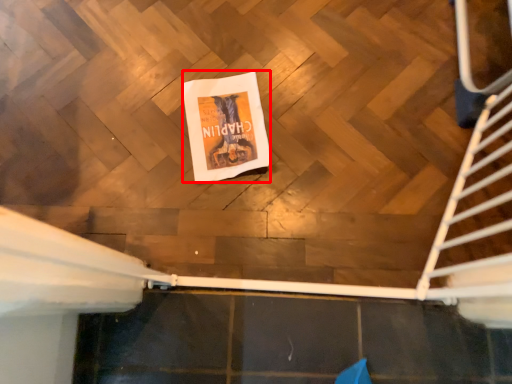
Question: Where is flyer (annotated by the red box) located in relation to stairs in the image?

Choices:
 (A) left
 (B) right

Answer: (A)